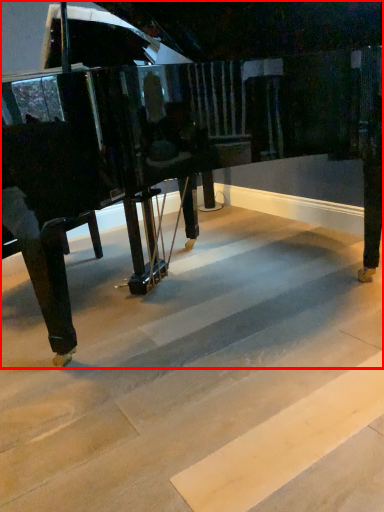
Question: From the image's perspective, what is the correct spatial relationship of piano (annotated by the red box) in relation to stair?

Choices:
 (A) above
 (B) below

Answer: (A)